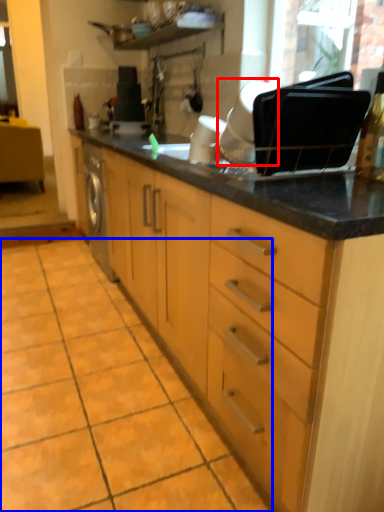
Question: Which object appears closest to the camera in this image, appliance (highlighted by a red box) or ceramic tile (highlighted by a blue box)?

Choices:
 (A) appliance
 (B) ceramic tile

Answer: (B)